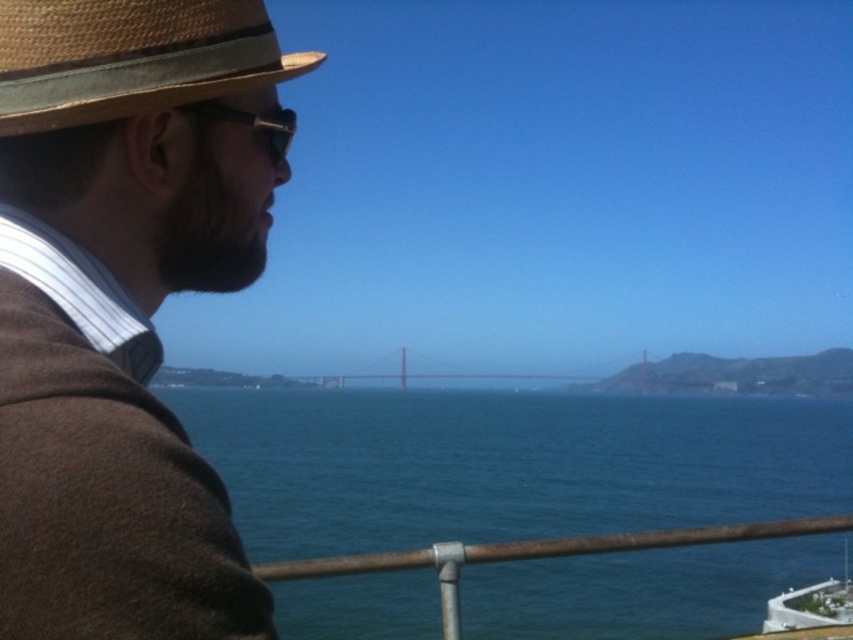
Is blue water at center above rusty metal rail at lower center?

No, blue water at center is not above rusty metal rail at lower center.

Who is taller, blue water at center or rusty metal rail at lower center?

blue water at center

I want to click on blue water at center, so click(x=508, y=465).